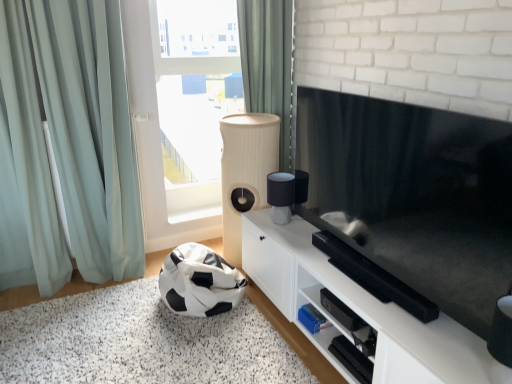
This screenshot has height=384, width=512. Identify the location of beige ribbed speaker at center. (245, 171).

Measure the distance between point (91, 142) and camera.

They are 8.35 feet apart.

I want to click on black and white fabric bean bag at lower left, so click(199, 282).

From the image's perspective, which one is positioned lower, black glossy tv at center or black and white fabric bean bag at lower left?

black and white fabric bean bag at lower left is shown below in the image.

At what (x,y) coordinates should I click in order to perform the action: click on plain that appears on the left of black glossy tv at center. Please return your answer as a coordinate pair (x, y). Image resolution: width=512 pixels, height=384 pixels. Looking at the image, I should click on (141, 342).

Is black glossy tv at center inside the boundaries of black and white fabric bean bag at lower left, or outside?

black glossy tv at center is located beyond the bounds of black and white fabric bean bag at lower left.

Is black glossy tv at center positioned with its back to black and white fabric bean bag at lower left?

That's not correct — black glossy tv at center is not looking away from black and white fabric bean bag at lower left.

Is black and white fabric bean bag at lower left not close to black glossy tv at center?

black and white fabric bean bag at lower left is positioned a significant distance from black glossy tv at center.

Is black and white fabric bean bag at lower left aimed at black glossy tv at center?

No, black and white fabric bean bag at lower left is not oriented towards black glossy tv at center.

From a real-world perspective, is black and white fabric bean bag at lower left physically located above or below black glossy tv at center?

black and white fabric bean bag at lower left is below black glossy tv at center.

From the image's perspective, is black and white fabric bean bag at lower left positioned above or below black glossy tv at center?

Based on their image positions, black and white fabric bean bag at lower left is located beneath black glossy tv at center.

Considering the relative sizes of black glossy tv at center and transparent glass window at upper center in the image provided, is black glossy tv at center bigger than transparent glass window at upper center?

Incorrect, black glossy tv at center is not larger than transparent glass window at upper center.

Between black glossy tv at center and transparent glass window at upper center, which one has more height?

Standing taller between the two is transparent glass window at upper center.

Relative to transparent glass window at upper center, is black glossy tv at center in front or behind?

Visually, black glossy tv at center is located in front of transparent glass window at upper center.

Which is in front, point (270, 160) or point (465, 210)?

The point (465, 210) is in front.

Measure the distance from beige ribbed speaker at center to black glossy tv at center.

beige ribbed speaker at center and black glossy tv at center are 35.50 inches apart from each other.

Which object is further away from the camera, beige ribbed speaker at center or black glossy tv at center?

beige ribbed speaker at center is more distant.

From a real-world perspective, is beige ribbed speaker at center beneath black glossy tv at center?

Yes, from a real-world perspective, beige ribbed speaker at center is below black glossy tv at center.

Who is smaller, light blue fabric curtain at left, positioned as the 1th curtain in left-to-right order, or black and white fabric bean bag at lower left?

black and white fabric bean bag at lower left is smaller.

Does light blue fabric curtain at left, positioned as the 1th curtain in left-to-right order, contain black and white fabric bean bag at lower left?

No, black and white fabric bean bag at lower left is not surrounded by light blue fabric curtain at left, positioned as the 1th curtain in left-to-right order.

From the picture: From the image's perspective, is light blue fabric curtain at left, acting as the second curtain starting from the right, located above or below black and white fabric bean bag at lower left?

light blue fabric curtain at left, acting as the second curtain starting from the right, is situated higher than black and white fabric bean bag at lower left in the image.

I want to click on football lying below the light blue fabric curtain at left, positioned as the 1th curtain in left-to-right order (from the image's perspective), so click(x=199, y=282).

From a real-world perspective, which curtain is the 2nd one above the black and white fabric bean bag at lower left? Please provide its 2D coordinates.

[(268, 64)]

Is black and white fabric bean bag at lower left beside green fabric curtain at upper center, arranged as the second curtain when viewed from the left?

black and white fabric bean bag at lower left and green fabric curtain at upper center, arranged as the second curtain when viewed from the left, are clearly separated.

Considering the relative sizes of black and white fabric bean bag at lower left and green fabric curtain at upper center, arranged as the second curtain when viewed from the left, in the image provided, is black and white fabric bean bag at lower left smaller than green fabric curtain at upper center, arranged as the second curtain when viewed from the left,?

No, black and white fabric bean bag at lower left is not smaller than green fabric curtain at upper center, arranged as the second curtain when viewed from the left.

Is black and white fabric bean bag at lower left at the right side of green fabric curtain at upper center, arranged as the second curtain when viewed from the left?

No, black and white fabric bean bag at lower left is not to the right of green fabric curtain at upper center, arranged as the second curtain when viewed from the left.

Is black and white fabric bean bag at lower left far away from transparent glass window at upper center?

Indeed, black and white fabric bean bag at lower left is not near transparent glass window at upper center.

Can you tell me how much black and white fabric bean bag at lower left and transparent glass window at upper center differ in facing direction?

91.2 degrees separate the facing orientations of black and white fabric bean bag at lower left and transparent glass window at upper center.

From the image's perspective, would you say black and white fabric bean bag at lower left is positioned over transparent glass window at upper center?

Actually, black and white fabric bean bag at lower left appears below transparent glass window at upper center in the image.

Looking at this image, which of these two, black and white fabric bean bag at lower left or transparent glass window at upper center, is smaller?

black and white fabric bean bag at lower left is smaller.

Where is `plain beneath the black glossy tv at center (from a real-world perspective)`? Image resolution: width=512 pixels, height=384 pixels. plain beneath the black glossy tv at center (from a real-world perspective) is located at coordinates 141,342.

Find the location of a particular element. plain on the left of black glossy tv at center is located at coordinates (141, 342).

Considering their positions, is green fabric curtain at upper center, arranged as the second curtain when viewed from the left, positioned further to black and white fabric bean bag at lower left than transparent glass window at upper center?

green fabric curtain at upper center, arranged as the second curtain when viewed from the left, is further to black and white fabric bean bag at lower left.

Which object lies nearer to the anchor point beige ribbed speaker at center, light blue fabric curtain at left, acting as the second curtain starting from the right, or black and white fabric bean bag at lower left?

Among the two, black and white fabric bean bag at lower left is located nearer to beige ribbed speaker at center.

Based on the photo, considering their positions, is black glossy tv at center positioned further to beige ribbed speaker at center than black and white fabric bean bag at lower left?

black glossy tv at center lies further to beige ribbed speaker at center than the other object.

Based on the photo, from the image, which object appears to be nearer to black and white fabric bean bag at lower left, light blue fabric curtain at left, positioned as the 1th curtain in left-to-right order, or black glossy tv at center?

light blue fabric curtain at left, positioned as the 1th curtain in left-to-right order, is closer to black and white fabric bean bag at lower left.

Considering their positions, is black and white fabric bean bag at lower left positioned further to white matte cabinet at center than beige ribbed speaker at center?

The object further to white matte cabinet at center is beige ribbed speaker at center.

From the picture: From the image, which object appears to be farther from green fabric curtain at upper center, arranged as the second curtain when viewed from the left, black glossy tv at center or transparent glass window at upper center?

black glossy tv at center.

When comparing their distances from black and white fabric bean bag at lower left, does black and white fabric bean bag at lower left or light blue fabric curtain at left, positioned as the 1th curtain in left-to-right order, seem further?

light blue fabric curtain at left, positioned as the 1th curtain in left-to-right order, is positioned further to the anchor black and white fabric bean bag at lower left.

When comparing their distances from black and white fabric bean bag at lower left, does white matte cabinet at center or black and white fabric bean bag at lower left seem further?

The object further to black and white fabric bean bag at lower left is white matte cabinet at center.

At what (x,y) coordinates should I click in order to perform the action: click on football between black glossy tv at center and transparent glass window at upper center along the z-axis. Please return your answer as a coordinate pair (x, y). The image size is (512, 384). Looking at the image, I should click on (199, 282).

Locate an element on the screen. The width and height of the screenshot is (512, 384). speaker between light blue fabric curtain at left, positioned as the 1th curtain in left-to-right order, and black glossy tv at center from left to right is located at coordinates (245, 171).

Find the location of `football between black glossy tv at center and green fabric curtain at upper center, arranged as the second curtain when viewed from the left, in the front-back direction`. football between black glossy tv at center and green fabric curtain at upper center, arranged as the second curtain when viewed from the left, in the front-back direction is located at coordinates (199, 282).

The height and width of the screenshot is (384, 512). Identify the location of cabinetry between black glossy tv at center and beige ribbed speaker at center along the z-axis. (360, 311).